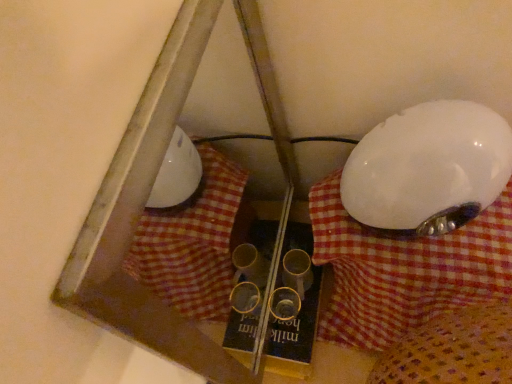
Question: Should I look upward or downward to see white checkered fabric at center?

Choices:
 (A) down
 (B) up

Answer: (A)

Question: Can you confirm if white glossy lampshade at right is thinner than yellow cardboard book at center?

Choices:
 (A) no
 (B) yes

Answer: (A)

Question: From a real-world perspective, is white glossy lampshade at right over yellow cardboard book at center?

Choices:
 (A) no
 (B) yes

Answer: (B)

Question: Does white glossy lampshade at right lie in front of yellow cardboard book at center?

Choices:
 (A) no
 (B) yes

Answer: (B)

Question: Is white glossy lampshade at right behind yellow cardboard book at center?

Choices:
 (A) yes
 (B) no

Answer: (B)

Question: From a real-world perspective, is white glossy lampshade at right physically below yellow cardboard book at center?

Choices:
 (A) yes
 (B) no

Answer: (B)

Question: Considering the relative sizes of white glossy lampshade at right and yellow cardboard book at center in the image provided, is white glossy lampshade at right taller than yellow cardboard book at center?

Choices:
 (A) yes
 (B) no

Answer: (A)

Question: Is white glossy lampshade at right to the left of white checkered fabric at center from the viewer's perspective?

Choices:
 (A) yes
 (B) no

Answer: (A)

Question: Is white glossy lampshade at right positioned beyond the bounds of white checkered fabric at center?

Choices:
 (A) yes
 (B) no

Answer: (A)

Question: Is white glossy lampshade at right oriented away from white checkered fabric at center?

Choices:
 (A) no
 (B) yes

Answer: (A)

Question: Is there a large distance between white glossy lampshade at right and white checkered fabric at center?

Choices:
 (A) no
 (B) yes

Answer: (A)

Question: Are white glossy lampshade at right and white checkered fabric at center beside each other?

Choices:
 (A) yes
 (B) no

Answer: (A)

Question: Does white glossy lampshade at right have a larger size compared to white checkered fabric at center?

Choices:
 (A) no
 (B) yes

Answer: (A)

Question: Considering the relative sizes of white checkered fabric at center and white glossy lampshade at right in the image provided, is white checkered fabric at center taller than white glossy lampshade at right?

Choices:
 (A) no
 (B) yes

Answer: (B)